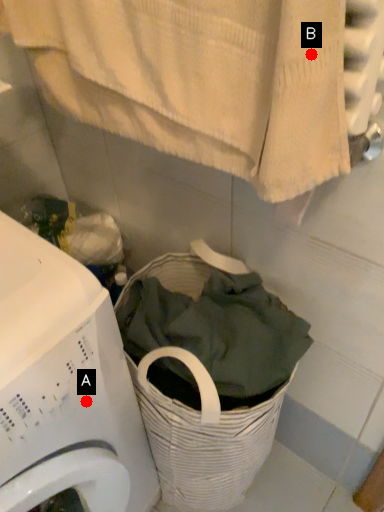
Question: Two points are circled on the image, labeled by A and B beside each circle. Which point is closer to the camera?

Choices:
 (A) A is closer
 (B) B is closer

Answer: (B)